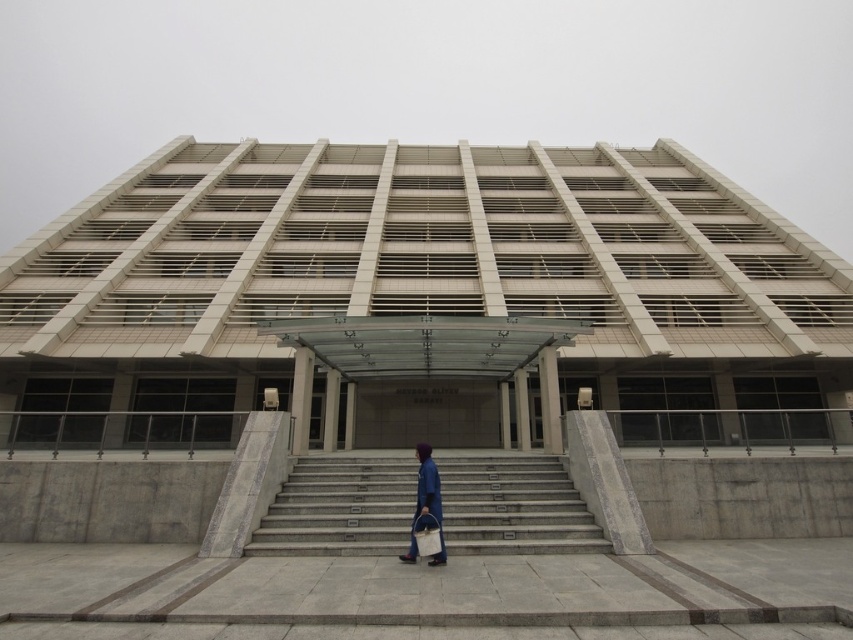
You are standing in front of the building and see the gray concrete stairs at center and the blue fabric bag at center. Which object is closer to the ground?

The gray concrete stairs at center is located below the blue fabric bag at center, so the gray concrete stairs at center is closer to the ground.